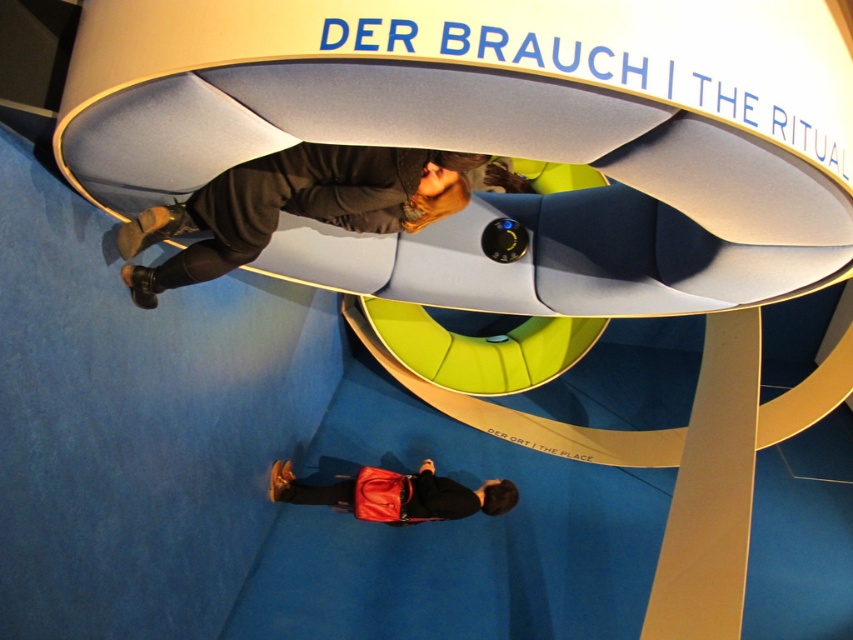
In the scene shown: You are an interior designer working on a layout for this space. You need to place a decorative pillow that must be exactly 10 cm away from the dark gray hoodie at upper center. Where should you place the pillow in relation to the hoodie?

The dark gray hoodie at upper center is located at point (294, 205). To place the decorative pillow exactly 10 cm away, you would need to position it either to the left, right, above, or below the hoodie, maintaining the 10 cm distance. However, without knowing the exact dimensions of the space, it is challenging to provide precise coordinates. Consider measuring the area to determine the best placement.

You are an interior designer planning to place a new accessory between the dark gray hoodie at upper center and the matte red bag at lower center. Which object should you place the accessory closer to if you want it to be closer to the left side of the room?

The dark gray hoodie at upper center is to the left of the matte red bag at lower center, so placing the accessory closer to the dark gray hoodie at upper center would position it nearer to the left side of the room.

You are an interior designer planning to place a new decorative item between the dark gray hoodie at upper center and the matte red bag at lower center. Based on their positions, which object should the decorative item be closer to?

The decorative item should be closer to the dark gray hoodie at upper center because it is in front of the matte red bag at lower center, indicating it is positioned nearer to the viewer.